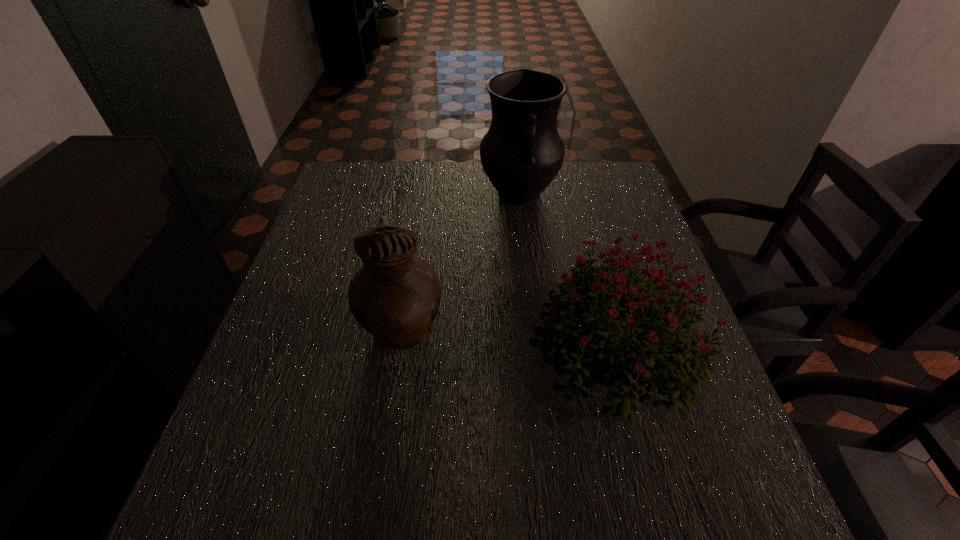
Find the location of a particular element. The image size is (960, 540). free region that satisfies the following two spatial constraints: 1. on the handle side of the farthest object; 2. at the spout of the nearer pitcher is located at coordinates (534, 335).

Identify the location of free region that satisfies the following two spatial constraints: 1. on the handle side of the right pitcher; 2. at the spout of the left pitcher. The width and height of the screenshot is (960, 540). (534, 335).

Find the location of a particular element. free space that satisfies the following two spatial constraints: 1. at the spout of the nearer pitcher; 2. on the left side of the bouquet is located at coordinates (398, 352).

Locate an element on the screen. vacant space that satisfies the following two spatial constraints: 1. at the spout of the bouquet; 2. on the left side of the left pitcher is located at coordinates (398, 352).

Where is `free region that satisfies the following two spatial constraints: 1. on the handle side of the farther pitcher; 2. at the spout of the leftmost object`? This screenshot has height=540, width=960. free region that satisfies the following two spatial constraints: 1. on the handle side of the farther pitcher; 2. at the spout of the leftmost object is located at coordinates (534, 335).

The width and height of the screenshot is (960, 540). Identify the location of vacant position in the image that satisfies the following two spatial constraints: 1. at the spout of the nearer pitcher; 2. on the left side of the bouquet. (398, 352).

The image size is (960, 540). Find the location of `free location that satisfies the following two spatial constraints: 1. on the handle side of the farther pitcher; 2. at the spout of the left pitcher`. free location that satisfies the following two spatial constraints: 1. on the handle side of the farther pitcher; 2. at the spout of the left pitcher is located at coordinates (534, 335).